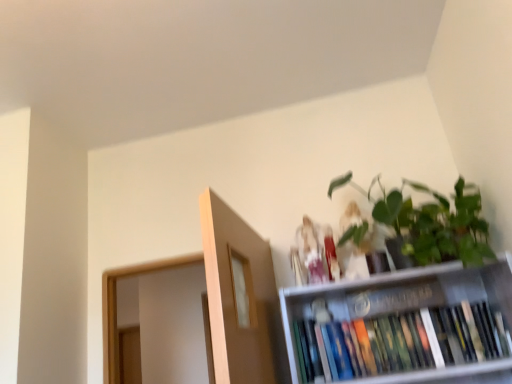
Question: Can we say green matte plant at upper right lies outside hardcover books at upper right?

Choices:
 (A) no
 (B) yes

Answer: (B)

Question: Considering the relative sizes of green matte plant at upper right and hardcover books at upper right in the image provided, is green matte plant at upper right wider than hardcover books at upper right?

Choices:
 (A) no
 (B) yes

Answer: (B)

Question: Considering the relative positions of green matte plant at upper right and hardcover books at upper right in the image provided, is green matte plant at upper right to the left of hardcover books at upper right from the viewer's perspective?

Choices:
 (A) no
 (B) yes

Answer: (A)

Question: Can you confirm if green matte plant at upper right is positioned to the right of hardcover books at upper right?

Choices:
 (A) yes
 (B) no

Answer: (A)

Question: From a real-world perspective, is green matte plant at upper right on top of hardcover books at upper right?

Choices:
 (A) no
 (B) yes

Answer: (B)

Question: Does green matte plant at upper right have a smaller size compared to hardcover books at upper right?

Choices:
 (A) yes
 (B) no

Answer: (B)

Question: Is matte white figurine at upper center, which appears as the 2th toy when viewed from the right, far from matte white figurine at upper center, which ranks as the 2th toy in left-to-right order?

Choices:
 (A) no
 (B) yes

Answer: (A)

Question: Is matte white figurine at upper center, the 1th toy in the left-to-right sequence, further to camera compared to matte white figurine at upper center, positioned as the first toy in right-to-left order?

Choices:
 (A) yes
 (B) no

Answer: (A)

Question: Considering the relative sizes of matte white figurine at upper center, which appears as the 2th toy when viewed from the right, and matte white figurine at upper center, positioned as the first toy in right-to-left order, in the image provided, is matte white figurine at upper center, which appears as the 2th toy when viewed from the right, bigger than matte white figurine at upper center, positioned as the first toy in right-to-left order,?

Choices:
 (A) no
 (B) yes

Answer: (A)

Question: Is matte white figurine at upper center, the 1th toy in the left-to-right sequence, at the right side of matte white figurine at upper center, which ranks as the 2th toy in left-to-right order?

Choices:
 (A) yes
 (B) no

Answer: (B)

Question: From the image's perspective, is matte white figurine at upper center, which appears as the 2th toy when viewed from the right, under matte white figurine at upper center, which ranks as the 2th toy in left-to-right order?

Choices:
 (A) yes
 (B) no

Answer: (A)

Question: Is matte white figurine at upper center, positioned as the first toy in right-to-left order, at the back of matte white figurine at upper center, which appears as the 2th toy when viewed from the right?

Choices:
 (A) yes
 (B) no

Answer: (B)

Question: Can you confirm if matte white figurine at upper center, the 1th toy in the left-to-right sequence, is thinner than green matte plant at upper right?

Choices:
 (A) yes
 (B) no

Answer: (A)